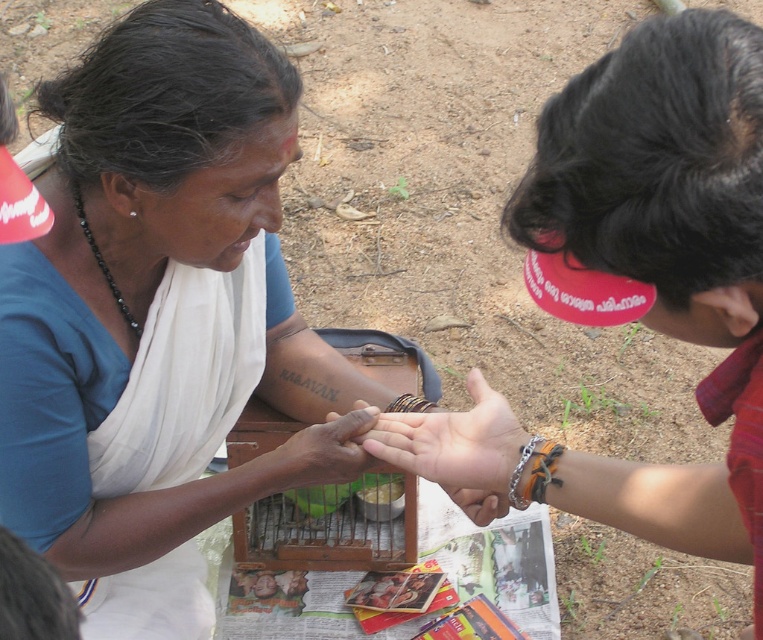
From the picture: Between silver metallic bracelet at lower center and brown leather bracelet at center, which one has more height?

silver metallic bracelet at lower center is taller.

Is point (513, 499) closer to camera compared to point (430, 406)?

Yes, point (513, 499) is in front of point (430, 406).

At what (x,y) coordinates should I click in order to perform the action: click on silver metallic bracelet at lower center. Please return your answer as a coordinate pair (x, y). Looking at the image, I should click on (520, 472).

From the picture: Is dark skin hand at center positioned before silver metallic bracelet at lower center?

No, dark skin hand at center is behind silver metallic bracelet at lower center.

Which is more to the right, dark skin hand at center or silver metallic bracelet at lower center?

From the viewer's perspective, silver metallic bracelet at lower center appears more on the right side.

Between point (346, 468) and point (522, 504), which one is positioned behind?

The point (346, 468) is behind.

This screenshot has height=640, width=763. Find the location of `dark skin hand at center`. dark skin hand at center is located at coordinates (330, 449).

Is point (501, 429) more distant than point (411, 406)?

That is False.

Who is positioned more to the left, matte red cap at upper right or brown leather bracelet at center?

From the viewer's perspective, brown leather bracelet at center appears more on the left side.

Does point (549, 132) come farther from viewer compared to point (410, 404)?

No, (549, 132) is in front of (410, 404).

Locate an element on the screen. The height and width of the screenshot is (640, 763). matte red cap at upper right is located at coordinates (667, 257).